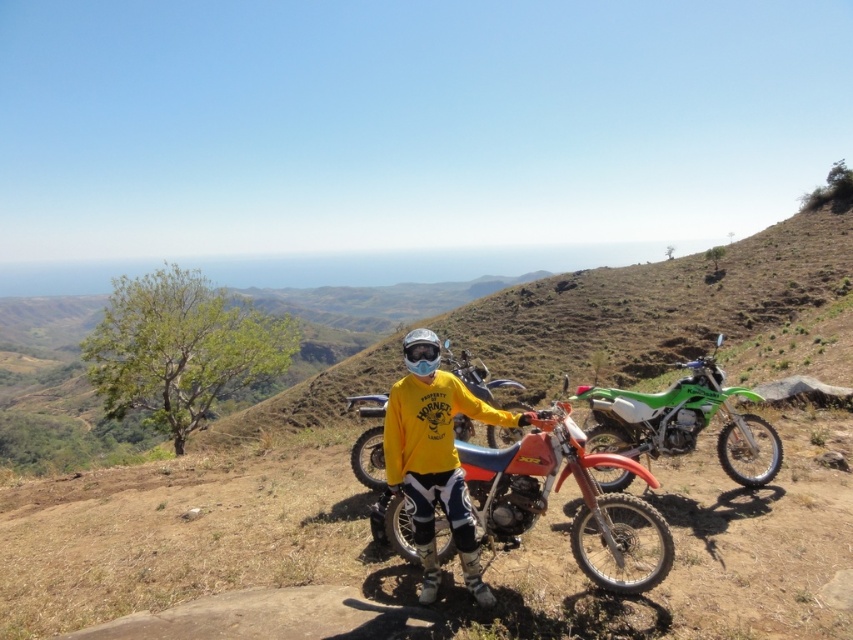
Question: Is brown dirt hillside at center smaller than matte red dirt bike at center?

Choices:
 (A) yes
 (B) no

Answer: (B)

Question: Based on their relative distances, which object is farther from the glossy white helmet at center?

Choices:
 (A) matte orange dirt bike at center
 (B) matte red dirt bike at center

Answer: (B)

Question: Is brown dirt hillside at center smaller than matte red dirt bike at center?

Choices:
 (A) yes
 (B) no

Answer: (B)

Question: Which of the following is the closest to the observer?

Choices:
 (A) matte orange dirt bike at center
 (B) green matte dirt bike at center
 (C) matte red dirt bike at center
 (D) brown dirt hillside at center

Answer: (A)

Question: Which object is closer to the camera taking this photo?

Choices:
 (A) yellow matte shirt at center
 (B) matte red dirt bike at center
 (C) brown dirt hillside at center

Answer: (A)

Question: Does green matte dirt bike at center appear on the right side of glossy white helmet at center?

Choices:
 (A) no
 (B) yes

Answer: (B)